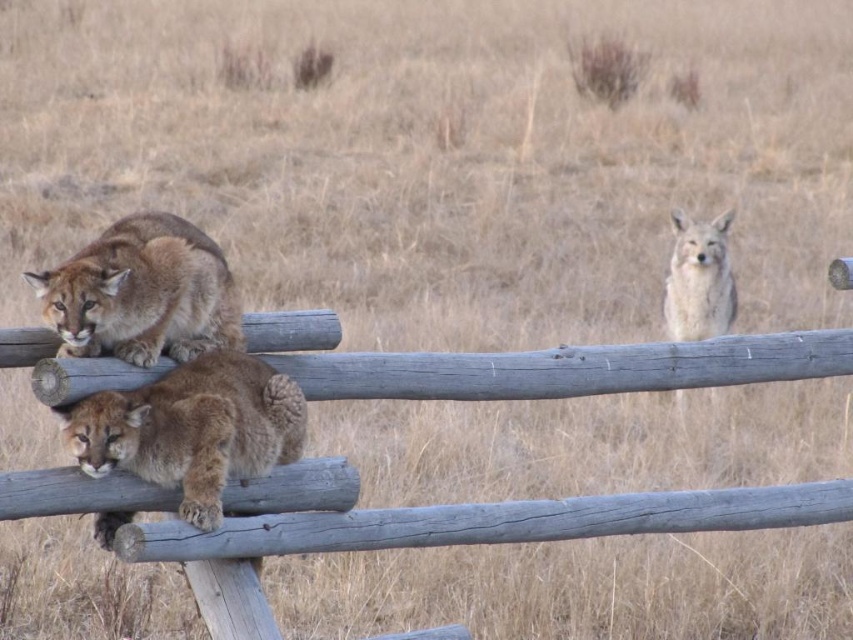
You are a photographer trying to capture both the brown furry cougar at center and the fuzzy beige fox at upper right in a single frame. Based on their positions, which animal should you adjust your camera to focus on first to ensure both are in the shot?

The brown furry cougar at center is to the left of the fuzzy beige fox at upper right, so you should focus on the fuzzy beige fox at upper right first to ensure both are within the frame.

Looking at this image, you are a wildlife photographer aiming to capture a clear image of the brown furry cougar at center. Given that your camera has a focal length of 200mm, what is the minimum distance you should maintain to ensure the cougar fits within the frame without cropping? Assume the sensor size is 36mm x 24mm and the cougar occupies 50 pixels in the image.

To determine the minimum distance, use the formula distance_in_mm x sensor_size_mm x pixels_in_image. The calculation would be distance x 36mm x 50 pixels. However, without knowing the actual size of the cougar, this calculation cannot be completed. Please provide the cougar size for an accurate answer.